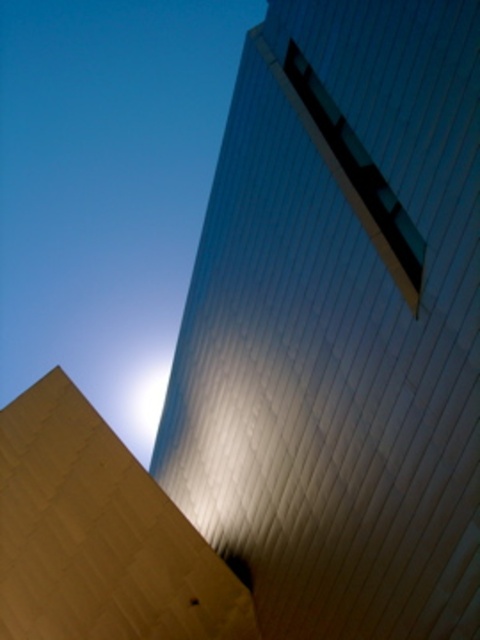
What object is located at the point with coordinates [340,324] in the scene?

The point with coordinates [340,324] corresponds to the matte beige pyramid at lower left.